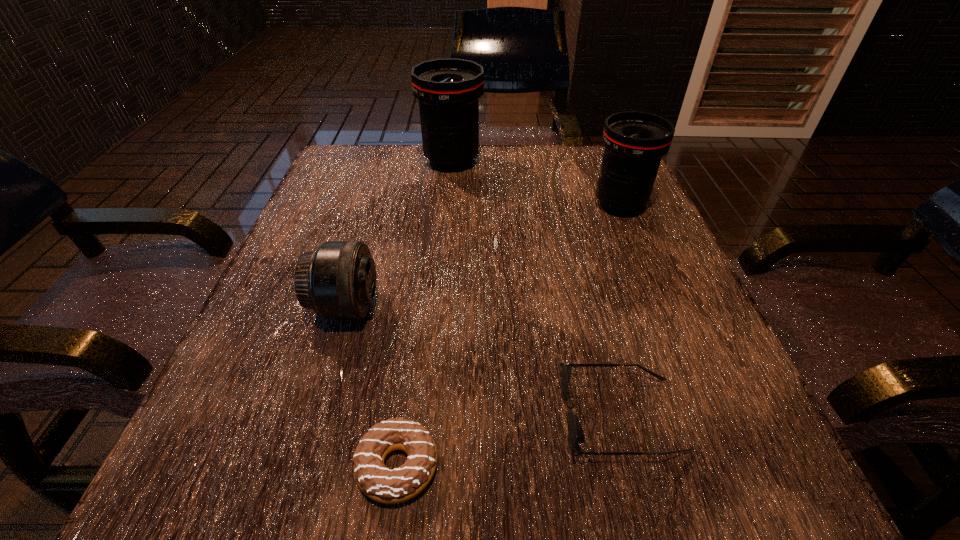
Select which telephoto lens appears as the third closest to the doughnut. Please provide its 2D coordinates. Your answer should be formatted as a tuple, i.e. [(x, y)], where the tuple contains the x and y coordinates of a point satisfying the conditions above.

[(448, 90)]

Locate an element on the screen. The image size is (960, 540). free region that satisfies the following two spatial constraints: 1. on the front-facing side of the nearest telephoto lens; 2. on the left side of the shortest object is located at coordinates (298, 466).

What are the coordinates of `vacant point that satisfies the following two spatial constraints: 1. on the front side of the second tallest object; 2. on the right side of the farthest object` in the screenshot? It's located at (447, 205).

The image size is (960, 540). I want to click on vacant space that satisfies the following two spatial constraints: 1. on the back side of the shortest object; 2. on the front-facing side of the leftmost telephoto lens, so click(x=420, y=307).

I want to click on vacant space that satisfies the following two spatial constraints: 1. on the front side of the fourth nearest object; 2. on the front-facing side of the nearest telephoto lens, so click(x=662, y=307).